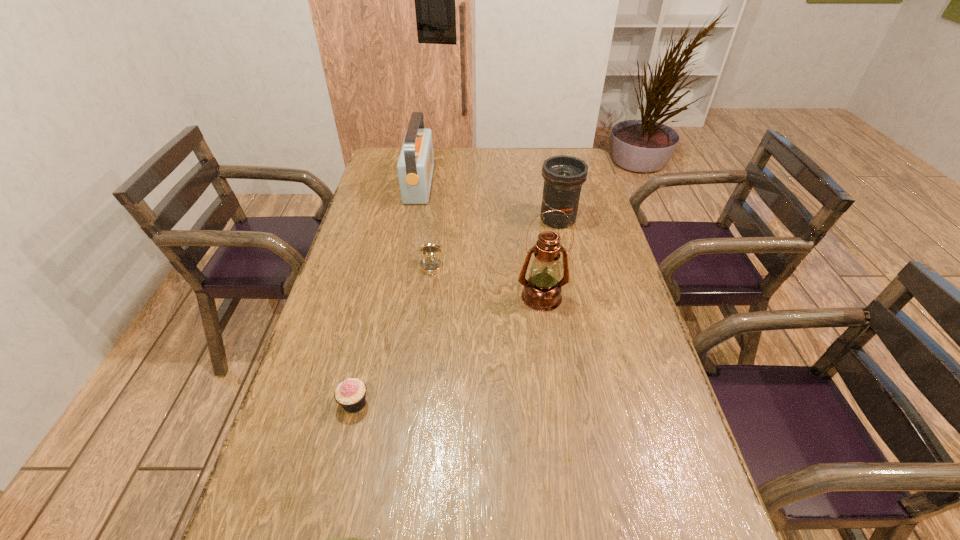
The image size is (960, 540). Identify the location of blank region between the tallest object and the radio receiver. point(480,240).

The image size is (960, 540). Find the location of `vacant point located between the telephoto lens and the cupcake`. vacant point located between the telephoto lens and the cupcake is located at coordinates 456,311.

In order to click on empty space between the fourth nearest object and the third nearest object in this screenshot , I will do `click(487, 282)`.

At what (x,y) coordinates should I click in order to perform the action: click on free space between the fifth farthest object and the oil lamp. Please return your answer as a coordinate pair (x, y). Looking at the image, I should click on (448, 350).

What are the coordinates of `free point between the radio receiver and the oil lamp` in the screenshot? It's located at (480, 240).

Where is `object identified as the second closest to the tallest object`? object identified as the second closest to the tallest object is located at coordinates (563, 175).

At what (x,y) coordinates should I click in order to perform the action: click on object that is the fifth closest to the cupcake. Please return your answer as a coordinate pair (x, y). Looking at the image, I should click on (415, 165).

Locate an element on the screen. The height and width of the screenshot is (540, 960). vacant space that satisfies the following two spatial constraints: 1. with the dial facing the tallest object; 2. on the left side of the fourth nearest object is located at coordinates (427, 297).

Find the location of a particular element. This screenshot has height=540, width=960. vacant region that satisfies the following two spatial constraints: 1. on the front-facing side of the radio receiver; 2. on the left side of the tallest object is located at coordinates (397, 297).

Find the location of a particular element. free space that satisfies the following two spatial constraints: 1. on the back side of the third tallest object; 2. on the left side of the fifth farthest object is located at coordinates (397, 219).